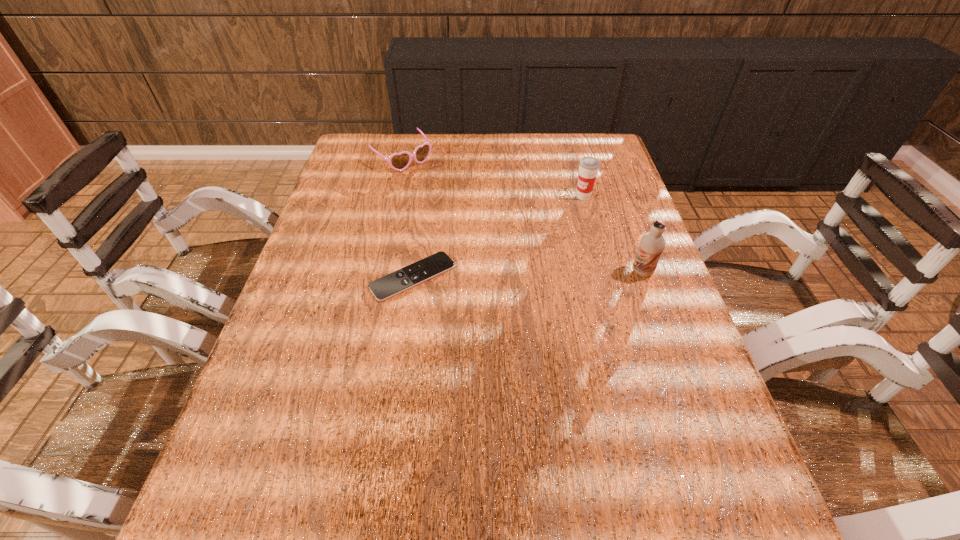
Where is `vacant space that satisfies the following two spatial constraints: 1. on the front side of the third tallest object; 2. on the right side of the chocolate milk`? vacant space that satisfies the following two spatial constraints: 1. on the front side of the third tallest object; 2. on the right side of the chocolate milk is located at coordinates (376, 272).

Image resolution: width=960 pixels, height=540 pixels. What are the coordinates of `vacant space that satisfies the following two spatial constraints: 1. on the front side of the sunglasses; 2. on the right side of the shortest object` in the screenshot? It's located at (375, 277).

Image resolution: width=960 pixels, height=540 pixels. In order to click on vacant space that satisfies the following two spatial constraints: 1. on the back side of the chocolate milk; 2. on the left side of the remote control in this screenshot , I will do (x=414, y=272).